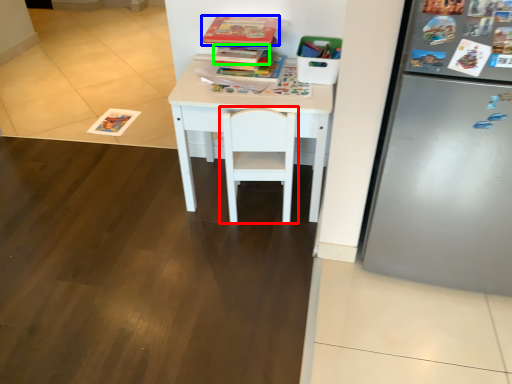
Question: Which is farther away from chair (highlighted by a red box)? book (highlighted by a blue box) or book (highlighted by a green box)?

Choices:
 (A) book
 (B) book

Answer: (A)